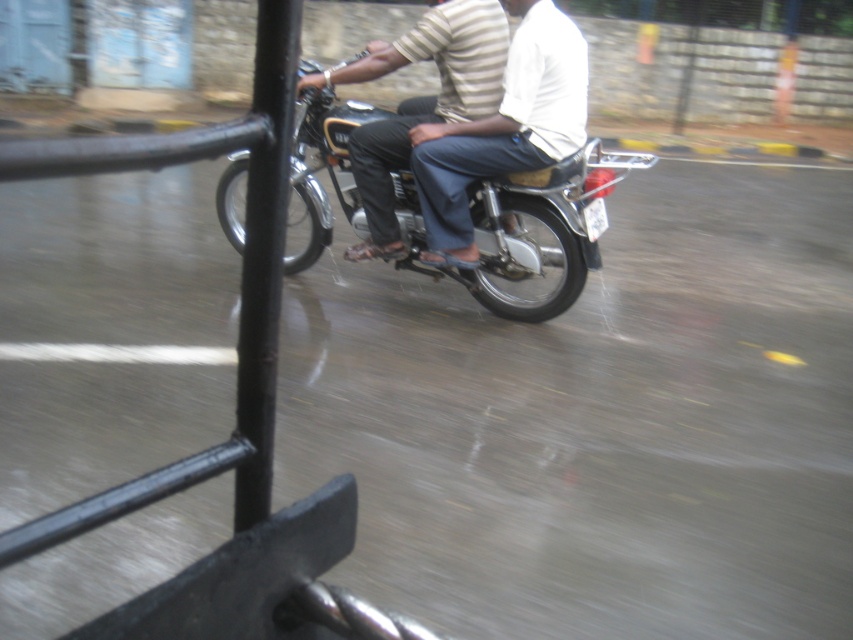
You are a photographer trying to capture the shiny metallic motorcycle at center and the light brown striped shirt at center. Based on their positions, which one is closer to the camera?

The shiny metallic motorcycle at center is taller than the light brown striped shirt at center, so it is closer to the camera.

You are a delivery person who needs to park your motorcycle on a wet road. The shiny metallic motorcycle at center is currently occupying a space. Can you park your motorcycle in the same spot without overlapping it?

The shiny metallic motorcycle at center is located at point [527,228], so you cannot park your motorcycle in the same spot without overlapping it since the coordinates indicate the exact position where it is currently placed.